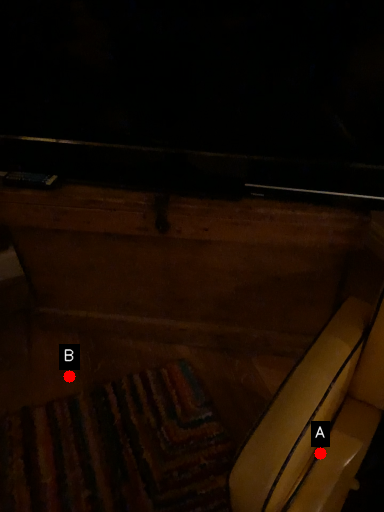
Question: Two points are circled on the image, labeled by A and B beside each circle. Among these points, which one is farthest from the camera?

Choices:
 (A) A is further
 (B) B is further

Answer: (B)